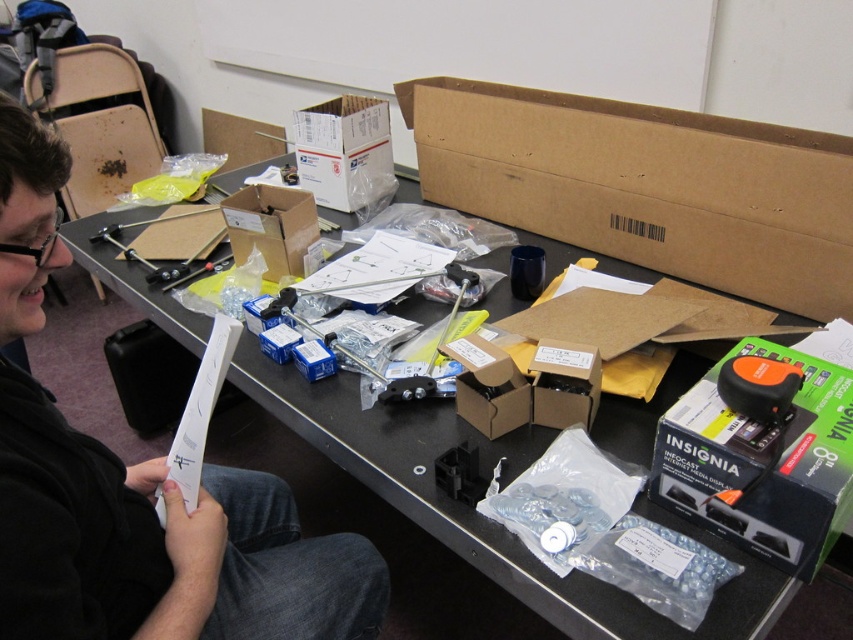
Who is positioned more to the left, black cardboard table at center or black plastic box at lower right?

black cardboard table at center is more to the left.

Between point (424, 522) and point (825, 412), which one is positioned behind?

Point (424, 522)

Where is `black cardboard table at center`? Image resolution: width=853 pixels, height=640 pixels. black cardboard table at center is located at coordinates (x=471, y=518).

Is brown cardboard box at upper right bigger than brown cardboard box at center?

Yes, brown cardboard box at upper right is bigger than brown cardboard box at center.

Is point (724, 168) behind point (459, 356)?

Yes.

Between point (677, 198) and point (492, 397), which one is positioned in front?

Point (492, 397) is more forward.

Locate an element on the screen. The image size is (853, 640). brown cardboard box at upper right is located at coordinates (647, 186).

Between black cardboard table at center and brown cardboard box at center, which one appears on the right side from the viewer's perspective?

Positioned to the right is brown cardboard box at center.

Does point (602, 609) lie behind point (496, 346)?

No, it is in front of (496, 346).

Is point (740, 630) behind point (457, 339)?

No.

Find the location of `black cardboard table at center`. black cardboard table at center is located at coordinates (471, 518).